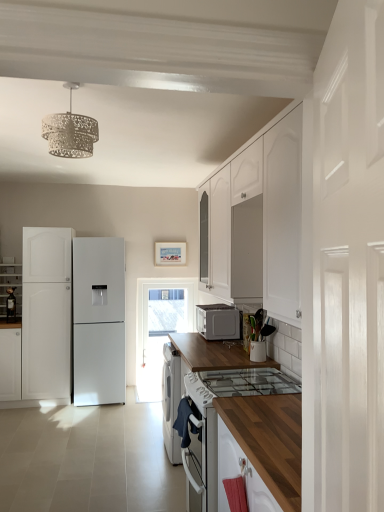
Question: Is point (3, 366) closer or farther from the camera than point (31, 380)?

Choices:
 (A) closer
 (B) farther

Answer: (A)

Question: In terms of width, does white matte cabinet at left, arranged as the 2th cabinetry when viewed from the left, look wider or thinner when compared to white matte refrigerator at left, positioned as the 3th cabinetry in left-to-right order?

Choices:
 (A) wide
 (B) thin

Answer: (B)

Question: Estimate the real-world distances between objects in this image. Which object is farther from the white glossy door at right?

Choices:
 (A) white glossy refrigerator at left, arranged as the first cabinetry when viewed from the left
 (B) white textured chandelier at upper center
 (C) transparent glass door at center
 (D) white matte cabinet at left, arranged as the 2th cabinetry when viewed from the left
 (E) white matte refrigerator at left, positioned as the 3th cabinetry in left-to-right order

Answer: (A)

Question: Estimate the real-world distances between objects in this image. Which object is farther from the white matte microwave at center?

Choices:
 (A) white textured chandelier at upper center
 (B) white matte cabinet at left, arranged as the 2th cabinetry when viewed from the left
 (C) white matte refrigerator at left, positioned as the 3th cabinetry in left-to-right order
 (D) white glossy door at right
 (E) white glossy refrigerator at left, the 3th cabinetry from the right

Answer: (D)